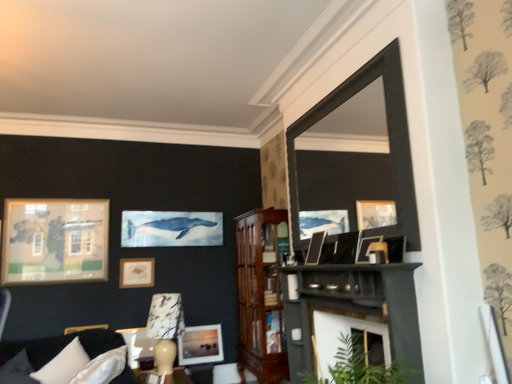
Question: Choose the correct answer: Is smooth dark wood shelf at center inside matte gold picture frame at upper left, the 5th picture frame viewed from the right, or outside it?

Choices:
 (A) outside
 (B) inside

Answer: (A)

Question: From a real-world perspective, relative to matte gold picture frame at upper left, the 5th picture frame viewed from the right, is smooth dark wood shelf at center vertically above or below?

Choices:
 (A) above
 (B) below

Answer: (B)

Question: Considering the real-world distances, which object is farthest from the matte black picture frame at center, which is the 4th picture frame from left to right?

Choices:
 (A) dark gray fabric couch at lower left
 (B) matte black picture frame at upper center, the 5th picture frame in the left-to-right sequence
 (C) smooth dark wood shelf at center
 (D) mahogany wood cabinet at center
 (E) matte gold picture frame at upper left, which appears as the fourth picture frame when viewed from the top

Answer: (E)

Question: Considering the real-world distances, which object is farthest from the matte black picture frame at center, acting as the third picture frame starting from the top?

Choices:
 (A) white marble lamp at lower center
 (B) dark gray fabric couch at lower left
 (C) smooth dark wood shelf at center
 (D) white fabric pillow at lower left
 (E) matte black picture frame at upper center, which is counted as the 1th picture frame, starting from the top

Answer: (D)